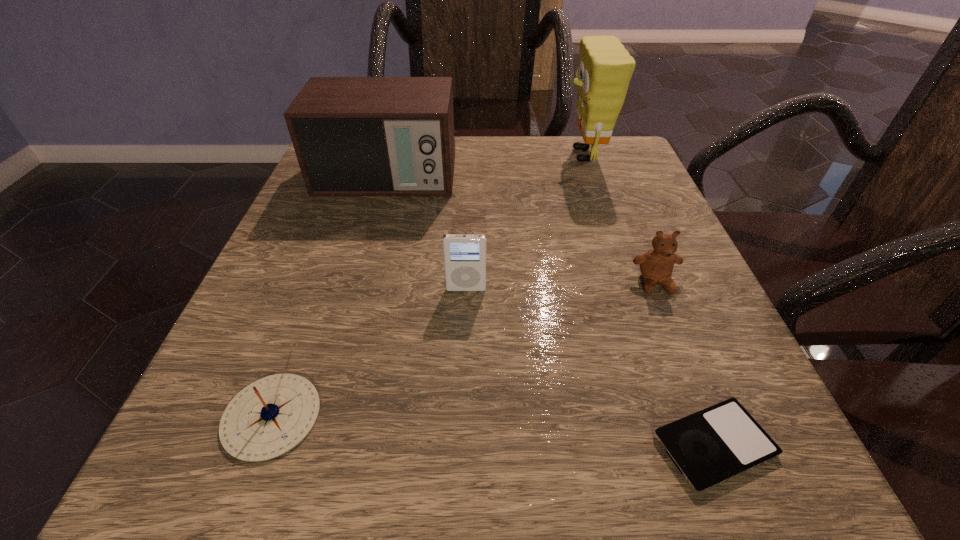
The image size is (960, 540). What are the coordinates of `the tallest object` in the screenshot? It's located at (605, 68).

Where is `the fifth shortest object`? the fifth shortest object is located at coordinates (353, 136).

You are a GUI agent. You are given a task and a screenshot of the screen. Output one action in this format:
    pyautogui.click(x=<x>, y=<y>)
    Task: Click on the taller iPod
    The width and height of the screenshot is (960, 540).
    Given the screenshot: What is the action you would take?
    pyautogui.click(x=464, y=254)

I want to click on the farther iPod, so (x=464, y=254).

The width and height of the screenshot is (960, 540). I want to click on teddy bear, so click(x=656, y=266).

The height and width of the screenshot is (540, 960). I want to click on compass, so click(x=269, y=417).

Locate an element on the screen. The height and width of the screenshot is (540, 960). the right iPod is located at coordinates (711, 446).

Locate an element on the screen. The height and width of the screenshot is (540, 960). the nearer iPod is located at coordinates (711, 446).

Locate an element on the screen. vacant space positioned 0.290m on the face of the tallest object is located at coordinates tap(435, 155).

Image resolution: width=960 pixels, height=540 pixels. Find the location of `free location located on the face of the tallest object`. free location located on the face of the tallest object is located at coordinates (452, 155).